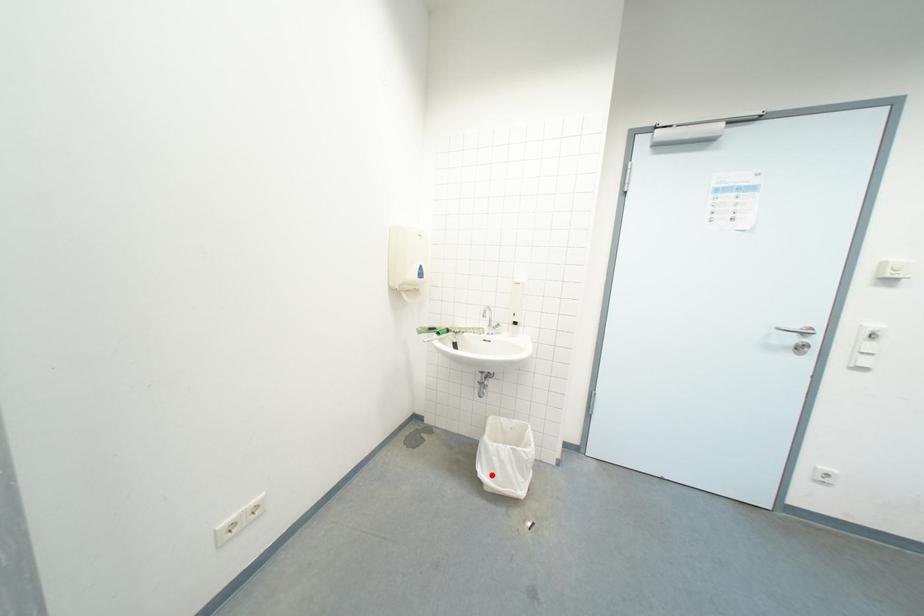
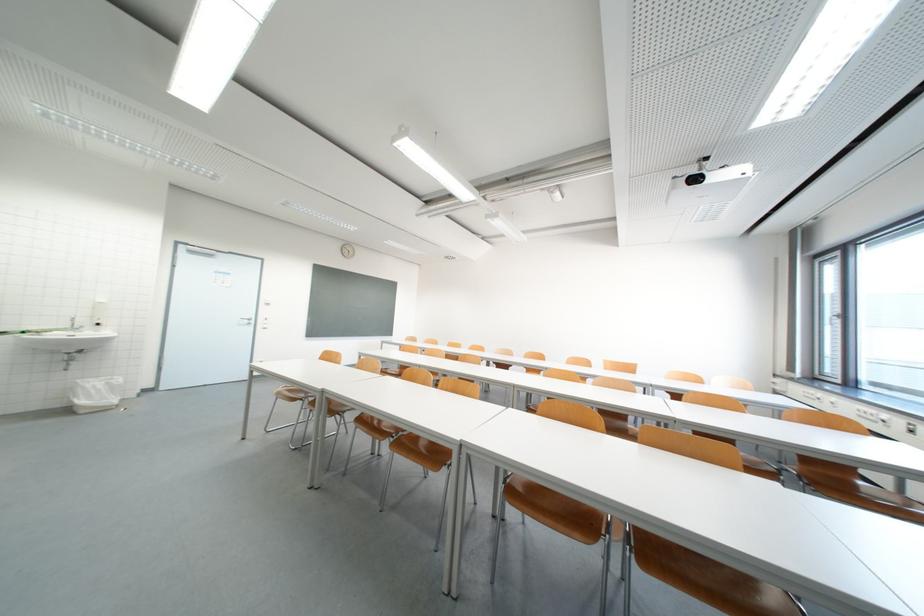
Question: I am providing you with two images of the same scene from different viewpoints. Given a red point in image1, look at the same physical point in image2. Is it:

Choices:
 (A) Closer to the viewpoint
 (B) Farther from the viewpoint

Answer: (A)